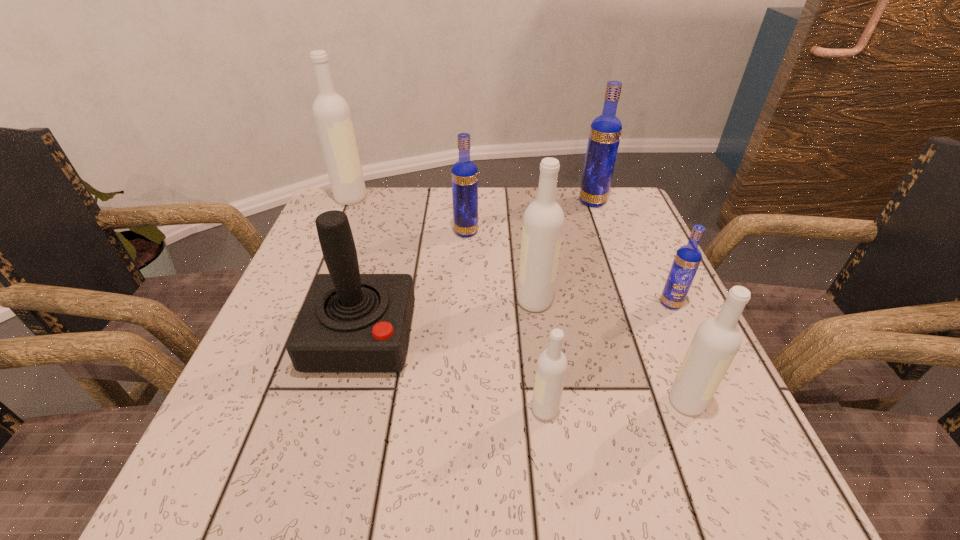
Locate an element on the screen. The height and width of the screenshot is (540, 960). free space between the smallest blue vodka and the biggest blue vodka is located at coordinates (632, 253).

Image resolution: width=960 pixels, height=540 pixels. I want to click on free space between the rightmost white vodka and the second biggest white vodka, so click(x=611, y=352).

I want to click on unoccupied position between the farthest white vodka and the third smallest white vodka, so click(x=443, y=249).

This screenshot has height=540, width=960. Identify the location of vacant area between the third farthest object and the tallest object. (408, 215).

What are the coordinates of `vacant area that lies between the rightmost blue vodka and the third smallest white vodka` in the screenshot? It's located at (603, 302).

Where is `free space between the second smallest white vodka and the sixth object from right to left`? The height and width of the screenshot is (540, 960). free space between the second smallest white vodka and the sixth object from right to left is located at coordinates (576, 317).

Find the location of a particular element. free spot between the third farthest vodka and the rightmost white vodka is located at coordinates (576, 317).

Identify which object is located as the second nearest to the third smallest white vodka. Please provide its 2D coordinates. Your answer should be formatted as a tuple, i.e. [(x, y)], where the tuple contains the x and y coordinates of a point satisfying the conditions above.

[(464, 174)]

Choose which object is the fourth nearest neighbor to the third nearest white vodka. Please provide its 2D coordinates. Your answer should be formatted as a tuple, i.e. [(x, y)], where the tuple contains the x and y coordinates of a point satisfying the conditions above.

[(688, 257)]

Point out which vodka is positioned as the second nearest to the sixth vodka from right to left. Please provide its 2D coordinates. Your answer should be formatted as a tuple, i.e. [(x, y)], where the tuple contains the x and y coordinates of a point satisfying the conditions above.

[(331, 113)]